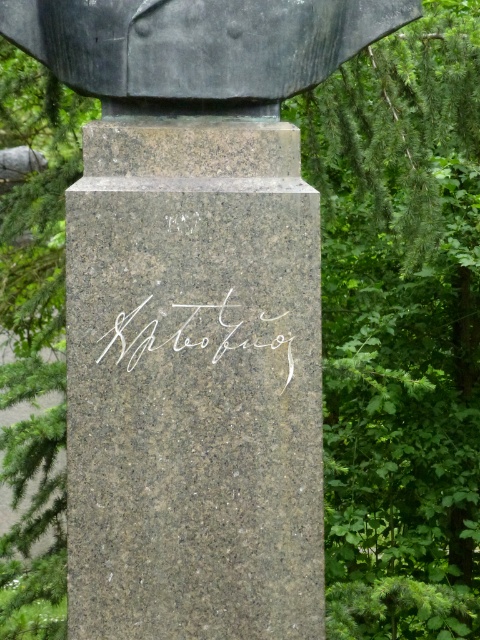
You are an art conservator examining the stone pedestal. You need to determine the spatial relationship between the polished dark gray bust at upper center and the white metallic writing at center. Which object is located to the right of the other?

The polished dark gray bust at upper center is positioned on the right side of white metallic writing at center.

You are an archaeologist examining the statue on the pedestal. You notice a specific point marked at coordinates (196, 48) on the pedestal. What does this point indicate?

The point at coordinates (196, 48) indicates the location of the polished dark gray bust at upper center on the pedestal.